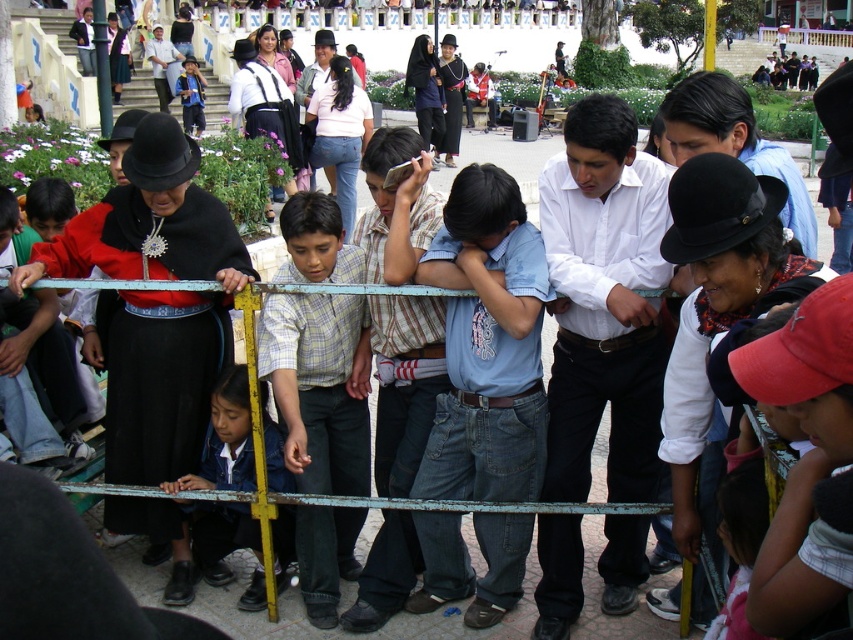
Question: Which of these objects is positioned closest to the light blue plaid shirt at center?

Choices:
 (A) blue denim jacket at center
 (B) denim jeans at center

Answer: (B)

Question: Where is white smooth shirt at center located in relation to blue school uniform at lower left in the image?

Choices:
 (A) above
 (B) below

Answer: (A)

Question: Among these points, which one is farthest from the camera?

Choices:
 (A) (753, 586)
 (B) (299, 196)
 (C) (412, 600)

Answer: (B)

Question: Is white smooth shirt at center positioned before light blue plaid shirt at center?

Choices:
 (A) no
 (B) yes

Answer: (B)

Question: Among these objects, which one is farthest from the camera?

Choices:
 (A) white shirt at upper center
 (B) red cap at lower right
 (C) blue school uniform at lower left

Answer: (A)

Question: Does light blue plaid shirt at center have a smaller size compared to white shirt at upper center?

Choices:
 (A) no
 (B) yes

Answer: (B)